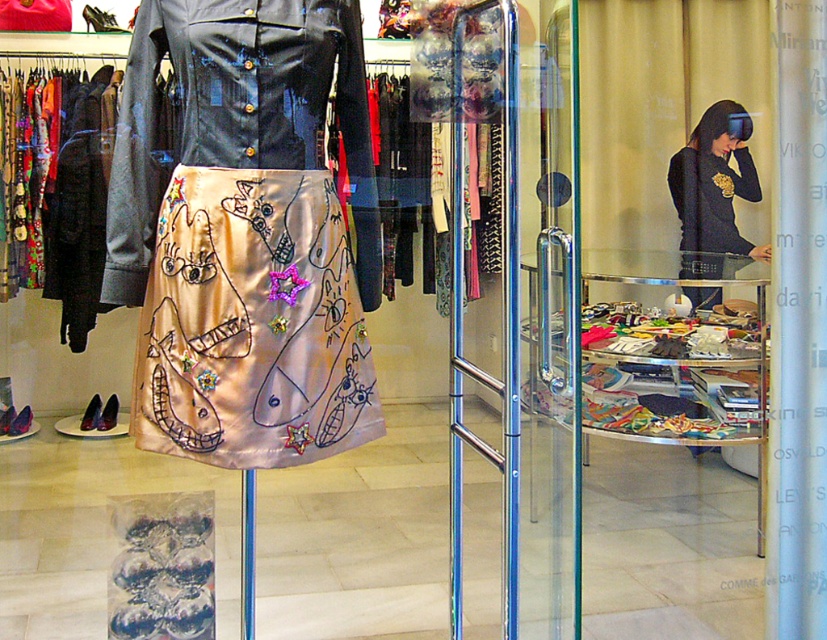
You are a customer trying to decide between the shiny black jacket at center and the black jersey at center. The store has a rack that can only hold items up to 1 meter in width. Which item would you choose to place on the rack without exceeding its width limit?

The shiny black jacket at center has a larger width than the black jersey at center. Since the rack can only hold items up to 1 meter wide, you should choose the black jersey at center to place on the rack to avoid exceeding the width limit.